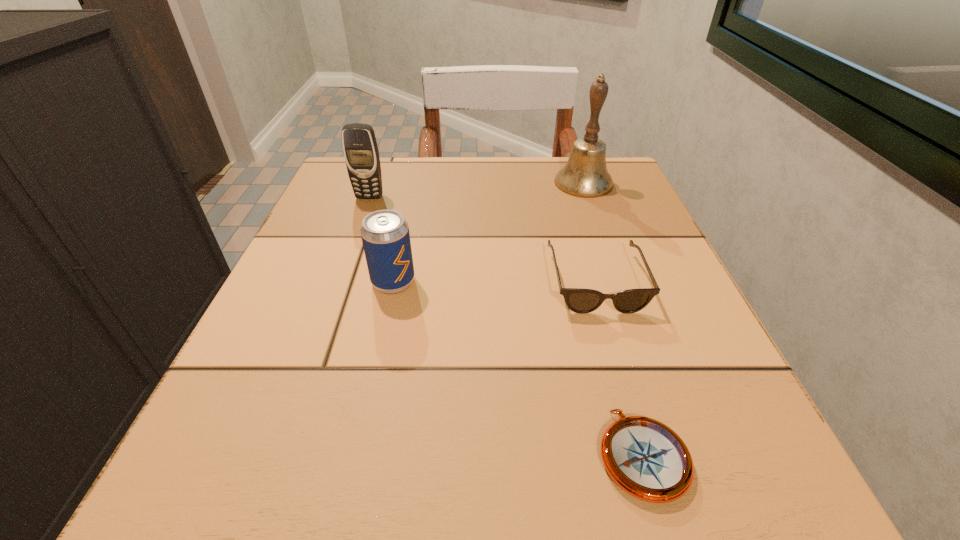
Locate an element on the screen. Image resolution: width=960 pixels, height=540 pixels. bell is located at coordinates (585, 174).

Locate an element on the screen. This screenshot has height=540, width=960. the leftmost object is located at coordinates (360, 149).

This screenshot has height=540, width=960. I want to click on the fourth shortest object, so click(360, 149).

In order to click on the second object from left to right in this screenshot , I will do `click(385, 235)`.

This screenshot has width=960, height=540. I want to click on the third shortest object, so click(x=385, y=235).

Find the location of a particular element. This screenshot has height=540, width=960. the second shortest object is located at coordinates (582, 301).

Locate an element on the screen. Image resolution: width=960 pixels, height=540 pixels. the shortest object is located at coordinates click(644, 457).

The height and width of the screenshot is (540, 960). Identify the location of compass. (644, 457).

Find the location of a particular element. vacant space situated 0.080m on the front of the bell is located at coordinates (596, 219).

Identify the location of vacant space located on the front face of the cellular telephone. (325, 320).